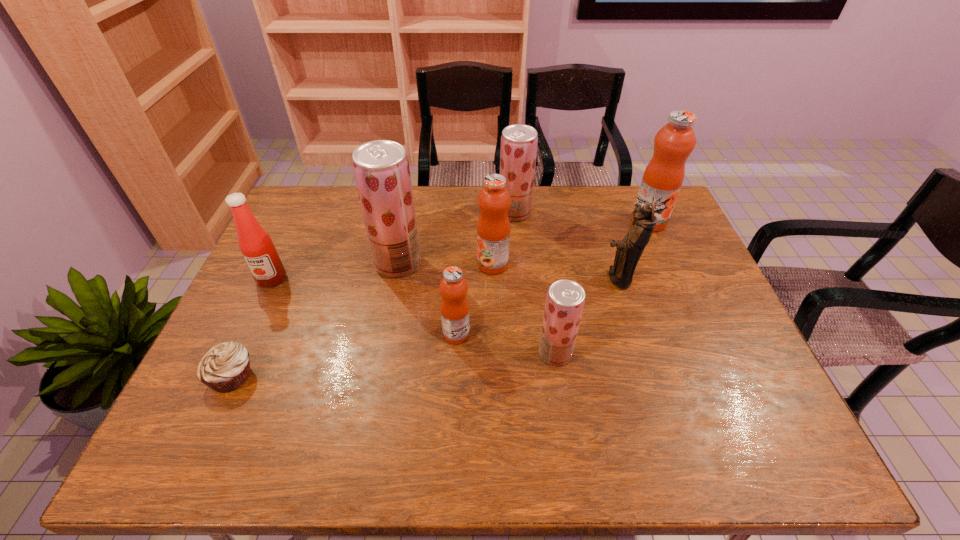
Find the location of a particular element. This screenshot has height=540, width=960. the smallest orange fruit juice is located at coordinates (454, 307).

I want to click on the sixth object from right to left, so click(x=454, y=307).

At what (x,y) coordinates should I click in order to perform the action: click on the shortest object. Please return your answer as a coordinate pair (x, y). The height and width of the screenshot is (540, 960). Looking at the image, I should click on (224, 368).

Locate an element on the screen. The image size is (960, 540). vacant space located on the back of the leftmost fruit juice is located at coordinates (413, 187).

The width and height of the screenshot is (960, 540). Identify the location of blank space located on the front label of the farthest orange fruit juice. (696, 329).

You are a GUI agent. You are given a task and a screenshot of the screen. Output one action in this format:
    pyautogui.click(x=<x>, y=<y>)
    Task: Click on the vacant space located on the right of the farthest strawberry fruit juice
    The height and width of the screenshot is (540, 960).
    Given the screenshot: What is the action you would take?
    pyautogui.click(x=560, y=213)

Identify the location of vacant space located on the front label of the second smallest orange fruit juice. (398, 264).

In order to click on vacant region located on the front label of the second smallest orange fruit juice in this screenshot , I will do `click(450, 264)`.

You are a GUI agent. You are given a task and a screenshot of the screen. Output one action in this format:
    pyautogui.click(x=<x>, y=<y>)
    Task: Click on the vacant space located on the front label of the second smallest orange fruit juice
    
    Given the screenshot: What is the action you would take?
    pyautogui.click(x=382, y=264)

The width and height of the screenshot is (960, 540). I want to click on vacant space situated on the front-facing side of the second object from right to left, so click(x=463, y=278).